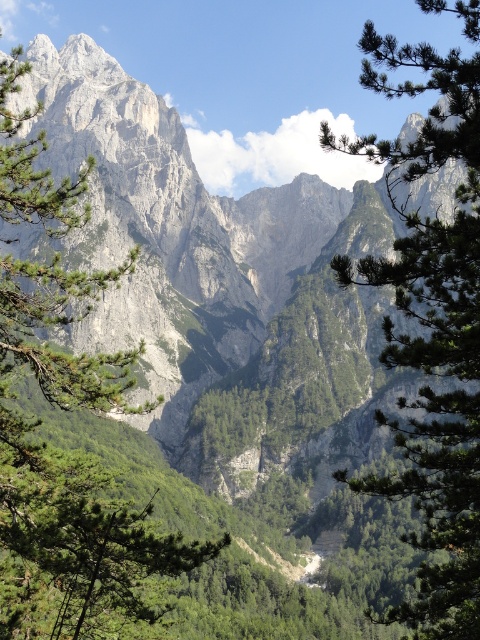
Question: Considering the relative positions of green leafy tree at left and green leafy tree at center in the image provided, where is green leafy tree at left located with respect to green leafy tree at center?

Choices:
 (A) right
 (B) left

Answer: (B)

Question: Which object appears farthest from the camera in this image?

Choices:
 (A) green leafy tree at left
 (B) green leafy tree at center

Answer: (A)

Question: Does green leafy tree at left have a greater width compared to green leafy tree at center?

Choices:
 (A) no
 (B) yes

Answer: (B)

Question: Does green leafy tree at left appear over green leafy tree at center?

Choices:
 (A) no
 (B) yes

Answer: (B)

Question: Which of the following is the farthest from the observer?

Choices:
 (A) (94, 509)
 (B) (475, 419)

Answer: (A)